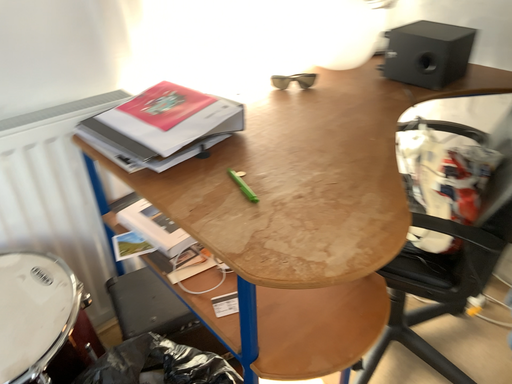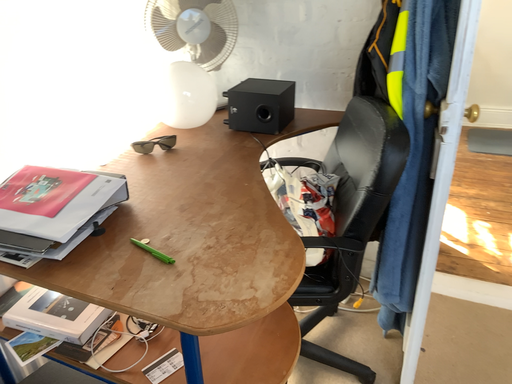
Question: How did the camera likely rotate when shooting the video?

Choices:
 (A) rotated downward
 (B) rotated upward

Answer: (B)